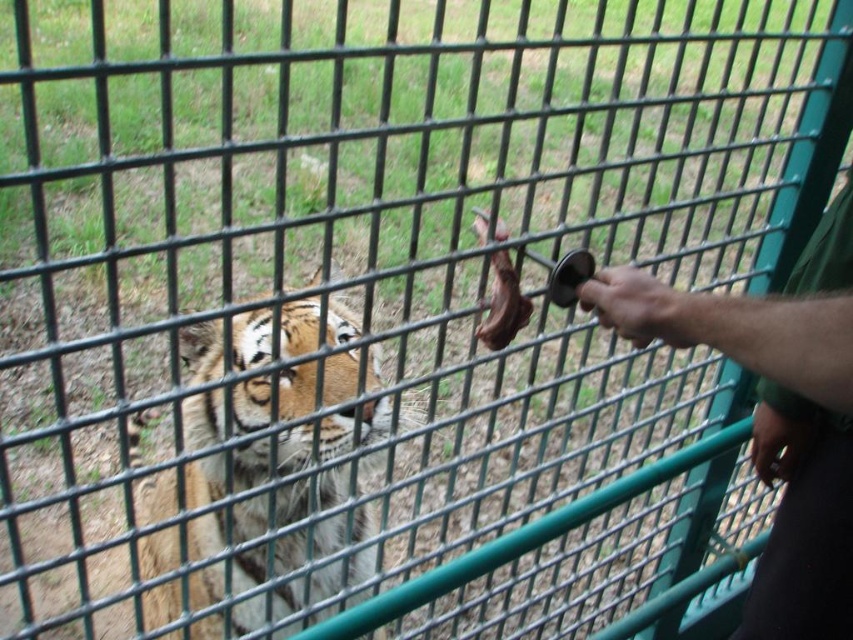
Question: Which point is farther from the camera taking this photo?

Choices:
 (A) (822, 476)
 (B) (352, 449)
 (C) (769, 404)

Answer: (C)

Question: Observing the image, what is the correct spatial positioning of smooth skin hand at center right in reference to smooth skin hand at lower right?

Choices:
 (A) left
 (B) right

Answer: (A)

Question: Is smooth skin hand at center right positioned in front of smooth skin hand at lower right?

Choices:
 (A) yes
 (B) no

Answer: (A)

Question: Among these points, which one is farthest from the camera?

Choices:
 (A) (811, 420)
 (B) (635, 339)
 (C) (817, 264)

Answer: (A)

Question: Among these objects, which one is nearest to the camera?

Choices:
 (A) green fabric shirt at right
 (B) smooth skin hand at lower right
 (C) smooth skin hand at center right
 (D) orange fur tiger at center

Answer: (A)

Question: Does orange fur tiger at center appear on the right side of smooth skin hand at center right?

Choices:
 (A) no
 (B) yes

Answer: (A)